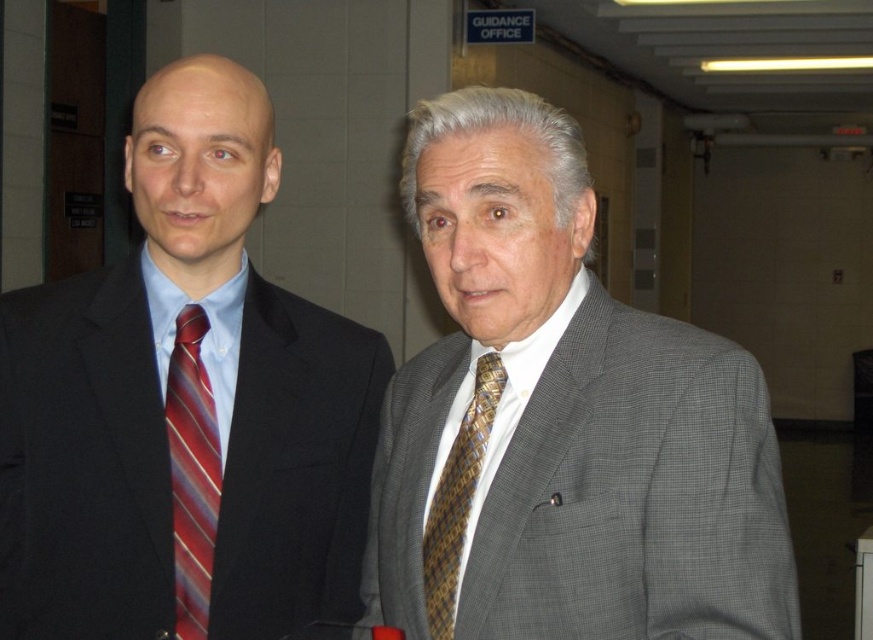
How much distance is there between gray textured suit at center and matte black suit at left?

The distance of gray textured suit at center from matte black suit at left is 13.05 inches.

Between gray textured suit at center and matte black suit at left, which one is positioned lower?

Positioned lower is gray textured suit at center.

Is point (583, 436) farther from camera compared to point (16, 323)?

That is False.

I want to click on gray textured suit at center, so click(561, 420).

Is striped silk tie at left further to the viewer compared to brown woven tie at center?

Yes, striped silk tie at left is further from the viewer.

Is striped silk tie at left positioned before brown woven tie at center?

No.

Which is behind, point (182, 504) or point (444, 616)?

The point (182, 504) is more distant.

Where is `striped silk tie at left`? This screenshot has height=640, width=873. striped silk tie at left is located at coordinates (191, 472).

Can you confirm if gray textured suit at center is taller than brown woven tie at center?

Indeed, gray textured suit at center has a greater height compared to brown woven tie at center.

Does gray textured suit at center appear under brown woven tie at center?

No.

Which is in front, point (719, 448) or point (478, 465)?

Point (719, 448) is more forward.

The width and height of the screenshot is (873, 640). What are the coordinates of `gray textured suit at center` in the screenshot? It's located at (561, 420).